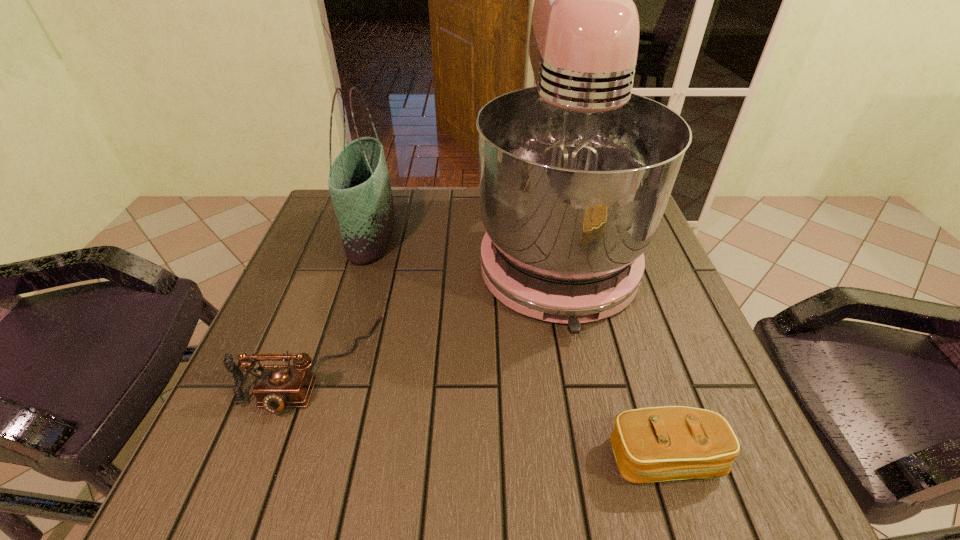
Image resolution: width=960 pixels, height=540 pixels. Find the location of `blank region between the telephone and the second tallest object`. blank region between the telephone and the second tallest object is located at coordinates (342, 299).

Where is `free spot between the telephone and the nearest object`? This screenshot has width=960, height=540. free spot between the telephone and the nearest object is located at coordinates (489, 411).

Identify which object is the second closest to the mixer. Please provide its 2D coordinates. Your answer should be formatted as a tuple, i.e. [(x, y)], where the tuple contains the x and y coordinates of a point satisfying the conditions above.

[(277, 386)]

This screenshot has width=960, height=540. What are the coordinates of `object that stands as the second closest to the second tallest object` in the screenshot? It's located at (575, 173).